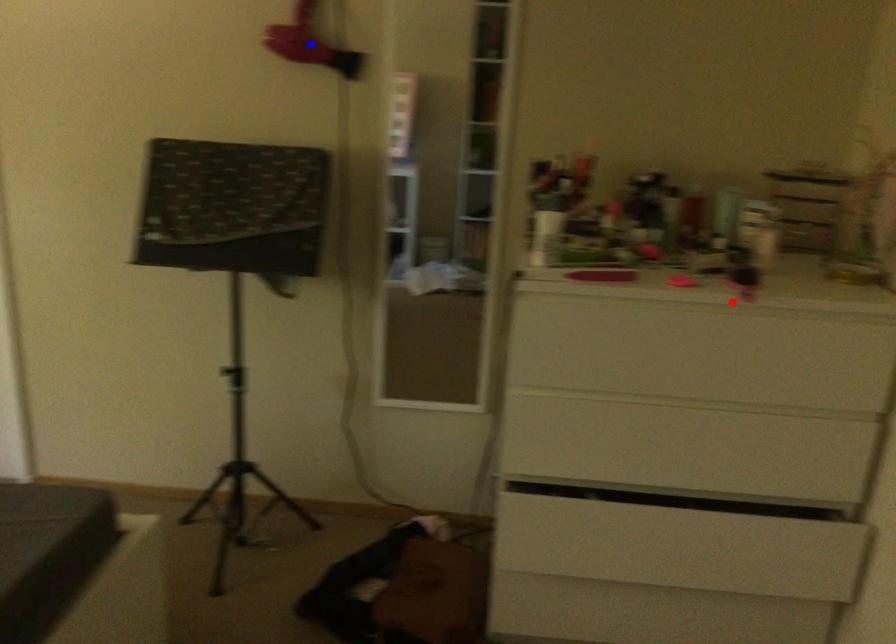
Question: In the image, two points are highlighted. Which point is nearer to the camera? Reply with the corresponding letter.

Choices:
 (A) blue point
 (B) red point

Answer: (B)